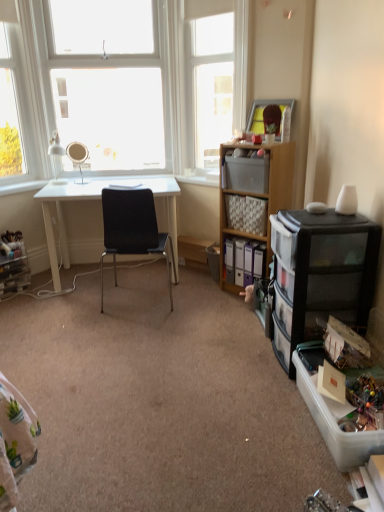
Locate an element on the screen. free space in front of white glossy lamp at upper left is located at coordinates (56, 188).